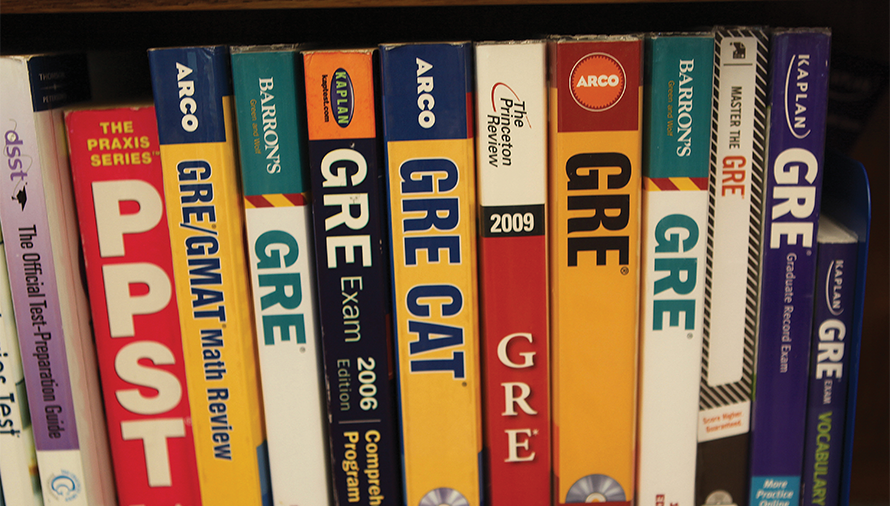
This screenshot has height=506, width=890. I want to click on third book from left side of image, so click(150, 288).